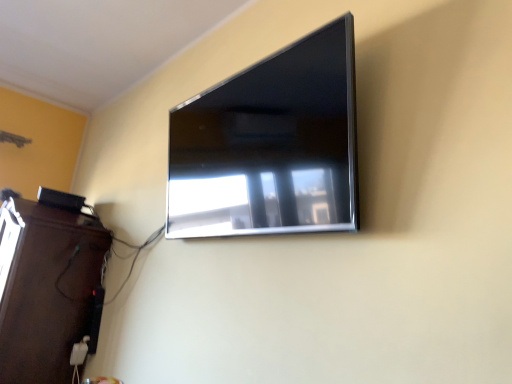
Question: From the image's perspective, is dark wood entertainment center at lower left located above or below satin black tv at upper center?

Choices:
 (A) below
 (B) above

Answer: (A)

Question: Is dark wood entertainment center at lower left bigger or smaller than satin black tv at upper center?

Choices:
 (A) small
 (B) big

Answer: (B)

Question: Would you say dark wood entertainment center at lower left is to the left or to the right of satin black tv at upper center in the picture?

Choices:
 (A) right
 (B) left

Answer: (B)

Question: From the image's perspective, relative to dark wood entertainment center at lower left, is satin black tv at upper center above or below?

Choices:
 (A) below
 (B) above

Answer: (B)

Question: Is satin black tv at upper center bigger or smaller than dark wood entertainment center at lower left?

Choices:
 (A) small
 (B) big

Answer: (A)

Question: Considering the positions of satin black tv at upper center and dark wood entertainment center at lower left in the image, is satin black tv at upper center taller or shorter than dark wood entertainment center at lower left?

Choices:
 (A) tall
 (B) short

Answer: (B)

Question: Is point click(x=264, y=62) positioned closer to the camera than point click(x=8, y=289)?

Choices:
 (A) closer
 (B) farther

Answer: (A)